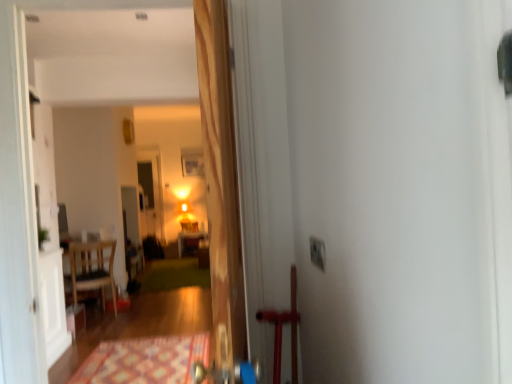
Question: Does point (313, 251) appear closer or farther from the camera than point (92, 288)?

Choices:
 (A) farther
 (B) closer

Answer: (B)

Question: From the image's perspective, is white plastic electric outlet at upper right above or below wooden chair at left?

Choices:
 (A) above
 (B) below

Answer: (A)

Question: Based on their relative distances, which object is nearer to the green carpet at center, positioned as the 1th doormat in back-to-front order?

Choices:
 (A) white plastic electric outlet at upper right
 (B) wooden chair at left
 (C) patterned carpet at lower center, which appears as the first doormat when viewed from the front
 (D) wooden table at center
 (E) wooden door at center

Answer: (D)

Question: Which object is the closest to the white plastic electric outlet at upper right?

Choices:
 (A) wooden chair at left
 (B) patterned carpet at lower center, which ranks as the 2th doormat in back-to-front order
 (C) wooden table at center
 (D) wooden door at center
 (E) green carpet at center, positioned as the 1th doormat in back-to-front order

Answer: (D)